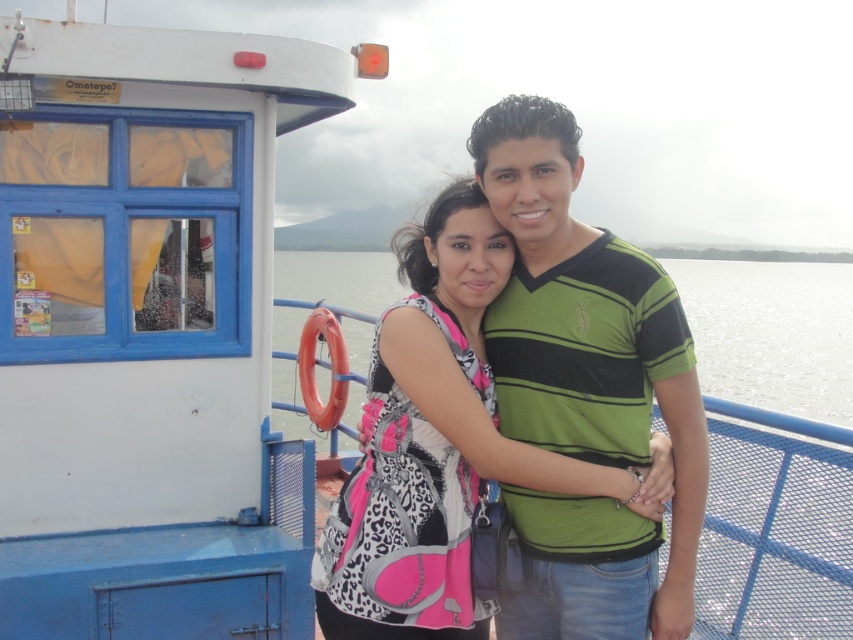
Where is `green striped shirt at center`? Image resolution: width=853 pixels, height=640 pixels. green striped shirt at center is located at coordinates (585, 390).